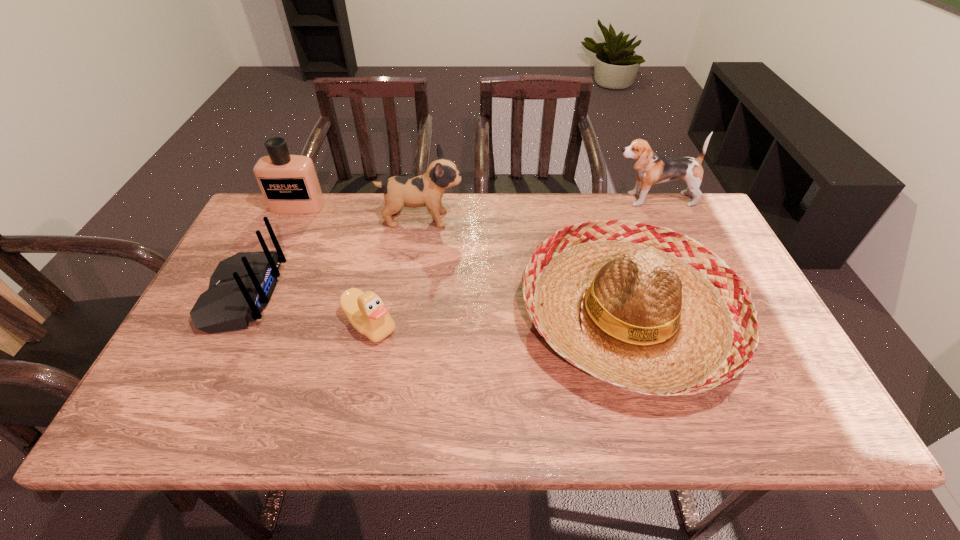
This screenshot has height=540, width=960. In order to click on free spot that satisfies the following two spatial constraints: 1. at the face of the right puppy; 2. at the beak of the duck in this screenshot , I will do `click(708, 325)`.

I want to click on free spot that satisfies the following two spatial constraints: 1. at the face of the left puppy; 2. on the back side of the sombrero, so click(x=407, y=316).

Where is `free space that satisfies the following two spatial constraints: 1. on the back of the sombrero; 2. on the right side of the router`? This screenshot has height=540, width=960. free space that satisfies the following two spatial constraints: 1. on the back of the sombrero; 2. on the right side of the router is located at coordinates (233, 316).

Image resolution: width=960 pixels, height=540 pixels. I want to click on free space that satisfies the following two spatial constraints: 1. on the front label of the perfume; 2. on the back of the fifth tallest object, so click(x=256, y=295).

Find the location of a particular element. vacant region that satisfies the following two spatial constraints: 1. on the back of the sombrero; 2. on the left side of the router is located at coordinates (233, 316).

Locate an element on the screen. This screenshot has height=540, width=960. vacant position in the image that satisfies the following two spatial constraints: 1. on the front label of the perfume; 2. on the back of the router is located at coordinates (256, 295).

Find the location of `free space that satisfies the following two spatial constraints: 1. at the face of the farther puppy; 2. on the front label of the perfume`. free space that satisfies the following two spatial constraints: 1. at the face of the farther puppy; 2. on the front label of the perfume is located at coordinates (655, 206).

What are the coordinates of `vacant area that satisfies the following two spatial constraints: 1. at the face of the sombrero; 2. on the right side of the nearer puppy` in the screenshot? It's located at (407, 316).

Identify the location of free spot that satisfies the following two spatial constraints: 1. at the face of the left puppy; 2. on the back side of the sombrero. (407, 316).

Where is `vacant space that satisfies the following two spatial constraints: 1. on the back of the second shortest object; 2. on the left side of the sombrero`? The image size is (960, 540). vacant space that satisfies the following two spatial constraints: 1. on the back of the second shortest object; 2. on the left side of the sombrero is located at coordinates (233, 316).